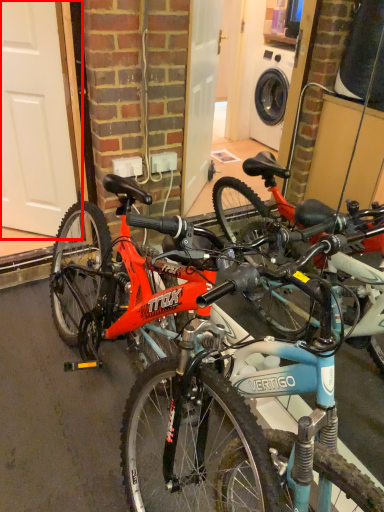
Question: From the image, what is the correct spatial relationship of garage door (annotated by the red box) in relation to bicycle?

Choices:
 (A) right
 (B) left

Answer: (B)